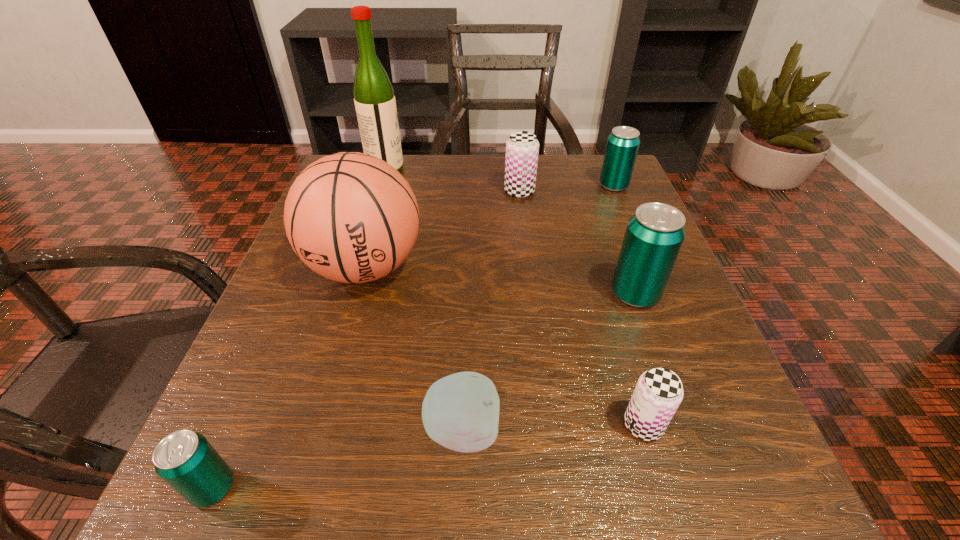
I want to click on the closest beer can to the orange basketball, so click(522, 148).

Identify which beer can is located as the third nearest to the second smallest teal beer can. Please provide its 2D coordinates. Your answer should be formatted as a tuple, i.e. [(x, y)], where the tuple contains the x and y coordinates of a point satisfying the conditions above.

[(658, 393)]

At what (x,y) coordinates should I click in order to perform the action: click on teal beer can that is the second nearest to the second tallest object. Please return your answer as a coordinate pair (x, y). Looking at the image, I should click on (654, 235).

Where is `teal beer can that stands as the second closest to the nearest beer can`? teal beer can that stands as the second closest to the nearest beer can is located at coordinates (623, 143).

Find the location of a particular element. The height and width of the screenshot is (540, 960). free point that satisfies the following two spatial constraints: 1. on the back side of the second nearest teal beer can; 2. on the label of the tallest object is located at coordinates pyautogui.click(x=589, y=169).

Find the location of `free space that satisfies the following two spatial constraints: 1. on the label of the liquor; 2. on the back side of the second biggest teal beer can`. free space that satisfies the following two spatial constraints: 1. on the label of the liquor; 2. on the back side of the second biggest teal beer can is located at coordinates (380, 186).

What are the coordinates of `vacant space that satisfies the following two spatial constraints: 1. on the surface of the second nearest beer can near the brand logo; 2. on the right side of the orange basketball` in the screenshot? It's located at (321, 425).

This screenshot has width=960, height=540. I want to click on vacant space that satisfies the following two spatial constraints: 1. on the surface of the seventh shortest object near the brand logo; 2. on the right side of the right purple beer can, so click(321, 425).